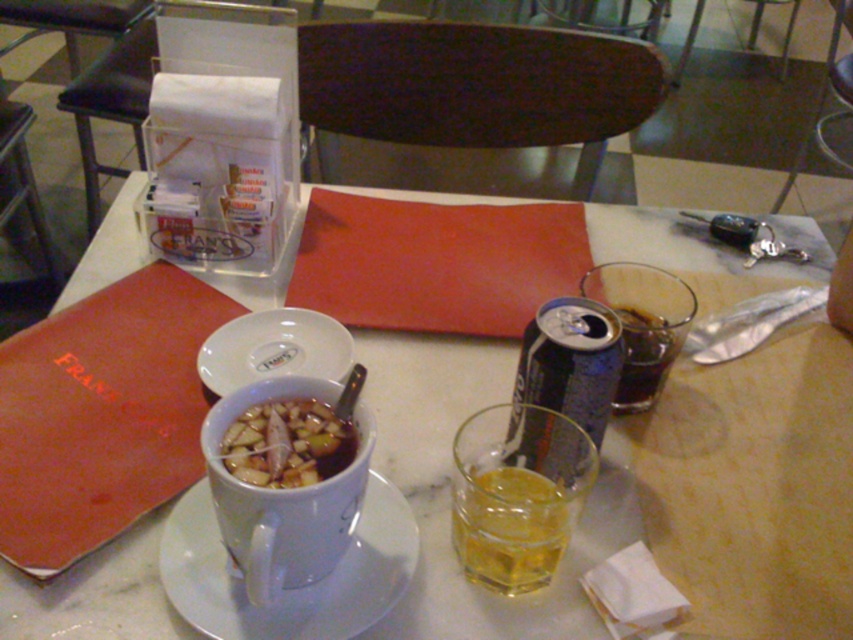
Looking at this image, between red felt place mat at center and dark brown carbonated can at upper right, which one is positioned higher?

red felt place mat at center is above.

Which is in front, point (492, 289) or point (636, 353)?

Point (636, 353) is more forward.

Where is `red felt place mat at center`? This screenshot has width=853, height=640. red felt place mat at center is located at coordinates (434, 262).

Does metallic silver can at center appear over white ceramic bowl at center?

Actually, metallic silver can at center is below white ceramic bowl at center.

Does metallic silver can at center have a greater width compared to white ceramic bowl at center?

In fact, metallic silver can at center might be narrower than white ceramic bowl at center.

You are a GUI agent. You are given a task and a screenshot of the screen. Output one action in this format:
    pyautogui.click(x=<x>, y=<y>)
    Task: Click on the metallic silver can at center
    
    Given the screenshot: What is the action you would take?
    pyautogui.click(x=572, y=362)

Who is lower down, white ceramic saucer at center or slightly translucent glass at center?

white ceramic saucer at center is lower down.

Measure the distance between white ceramic saucer at center and camera.

white ceramic saucer at center and camera are 49.17 centimeters apart from each other.

Identify the location of white ceramic saucer at center. (287, 589).

You are a GUI agent. You are given a task and a screenshot of the screen. Output one action in this format:
    pyautogui.click(x=<x>, y=<y>)
    Task: Click on the white ceramic saucer at center
    
    Given the screenshot: What is the action you would take?
    pyautogui.click(x=287, y=589)